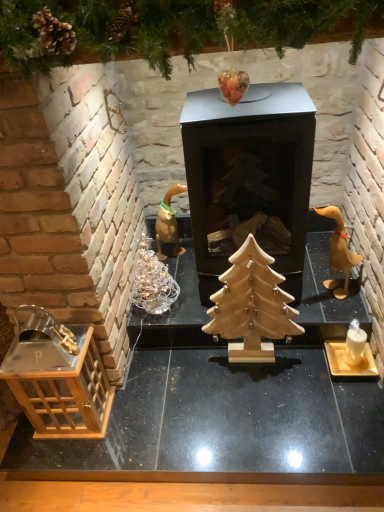
Where is `free space above wooden table at lower left (from a real-world perspective)`? Image resolution: width=384 pixels, height=512 pixels. free space above wooden table at lower left (from a real-world perspective) is located at coordinates (216, 410).